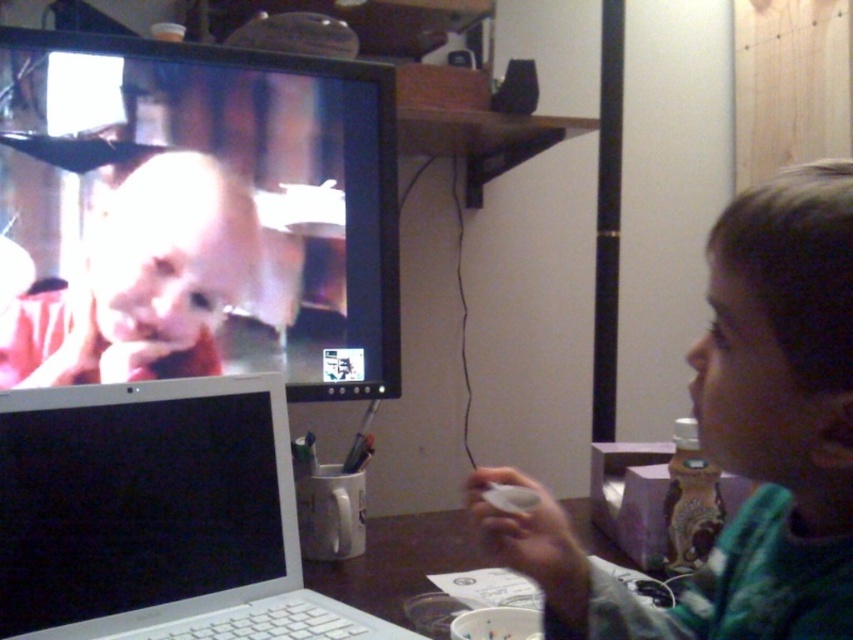
Question: Which point is farther to the camera?

Choices:
 (A) green plaid shirt at right
 (B) silver metallic laptop at lower left
 (C) matte black monitor at upper left

Answer: (C)

Question: Does green plaid shirt at right have a greater width compared to silver metallic laptop at lower left?

Choices:
 (A) yes
 (B) no

Answer: (B)

Question: In this image, where is matte black monitor at upper left located relative to smooth skin child at upper left?

Choices:
 (A) left
 (B) right

Answer: (B)

Question: Is green plaid shirt at right smaller than silver metallic laptop at lower left?

Choices:
 (A) yes
 (B) no

Answer: (B)

Question: Which point is closer to the camera taking this photo?

Choices:
 (A) (735, 444)
 (B) (73, 218)

Answer: (A)

Question: Which object is closer to the camera taking this photo?

Choices:
 (A) silver metallic laptop at lower left
 (B) green plaid shirt at right

Answer: (B)